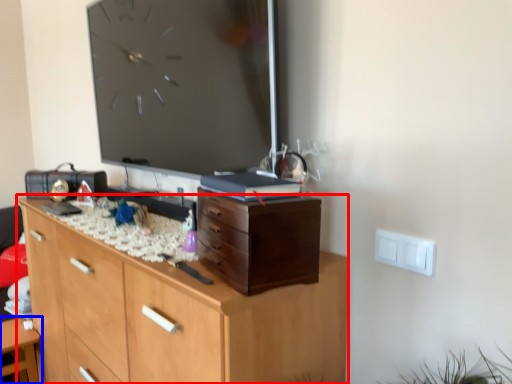
Question: Which point is closer to the camera, chest of drawers (highlighted by a red box) or table (highlighted by a blue box)?

Choices:
 (A) chest of drawers
 (B) table

Answer: (A)